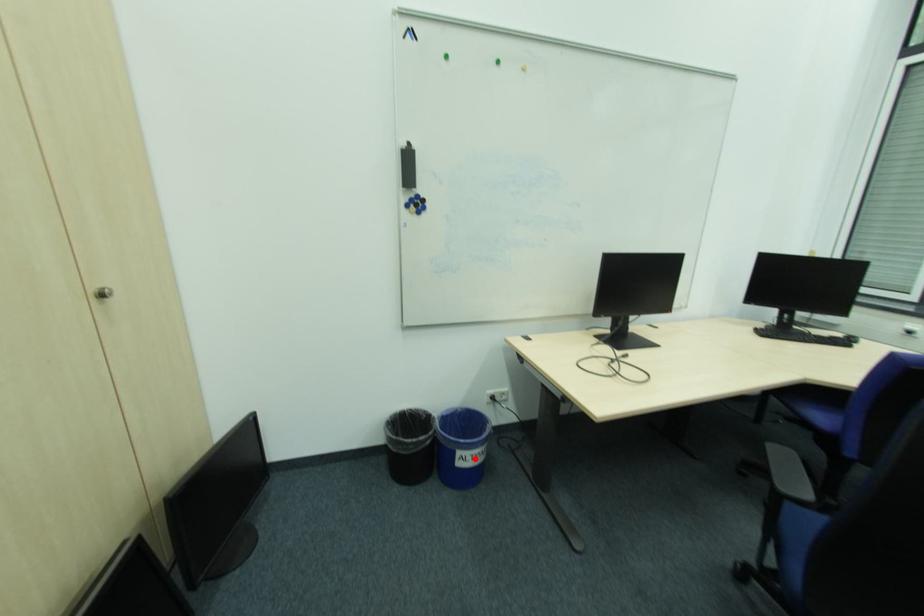
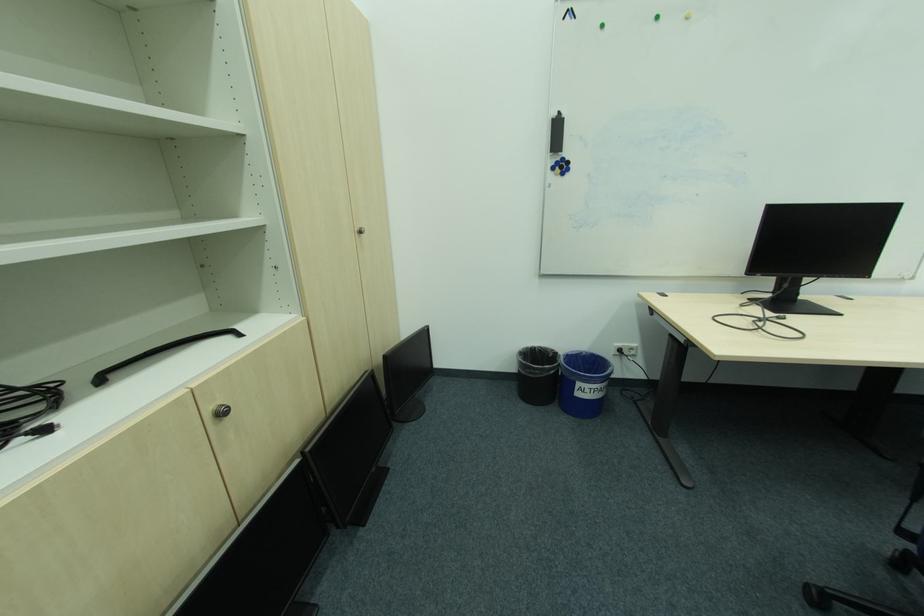
Find the pixel in the second image that matches the highlighted location in the first image.

(593, 391)